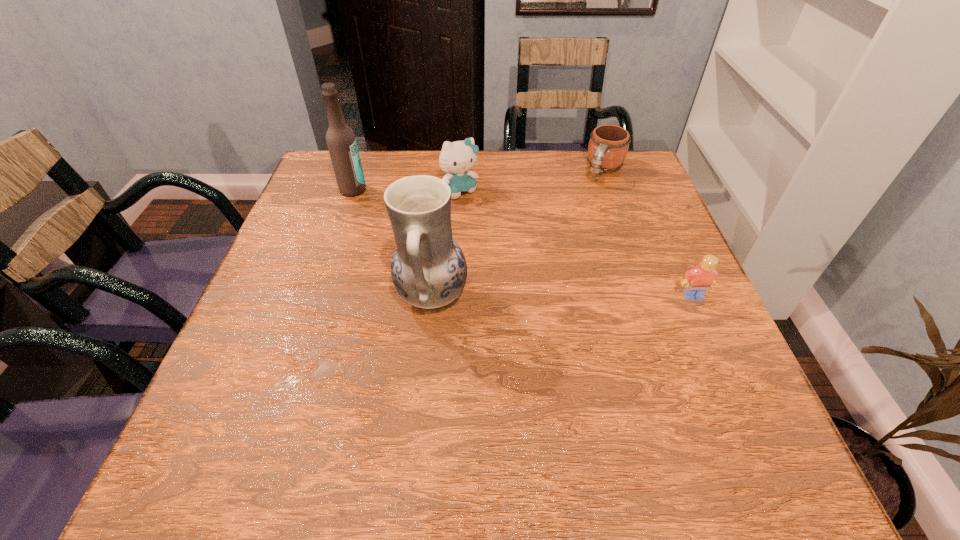
Where is `vacant space on the desktop that is between the pottery and the Lego and is positioned on the face of the third tallest object`? The width and height of the screenshot is (960, 540). vacant space on the desktop that is between the pottery and the Lego and is positioned on the face of the third tallest object is located at coordinates (556, 296).

The height and width of the screenshot is (540, 960). What are the coordinates of `vacant space on the desktop that is between the pottery and the Lego and is positioned on the label of the beer bottle` in the screenshot? It's located at (532, 296).

Locate an element on the screen. The image size is (960, 540). vacant space on the desktop that is between the pottery and the Lego and is positioned on the side of the mug with the handle is located at coordinates (526, 296).